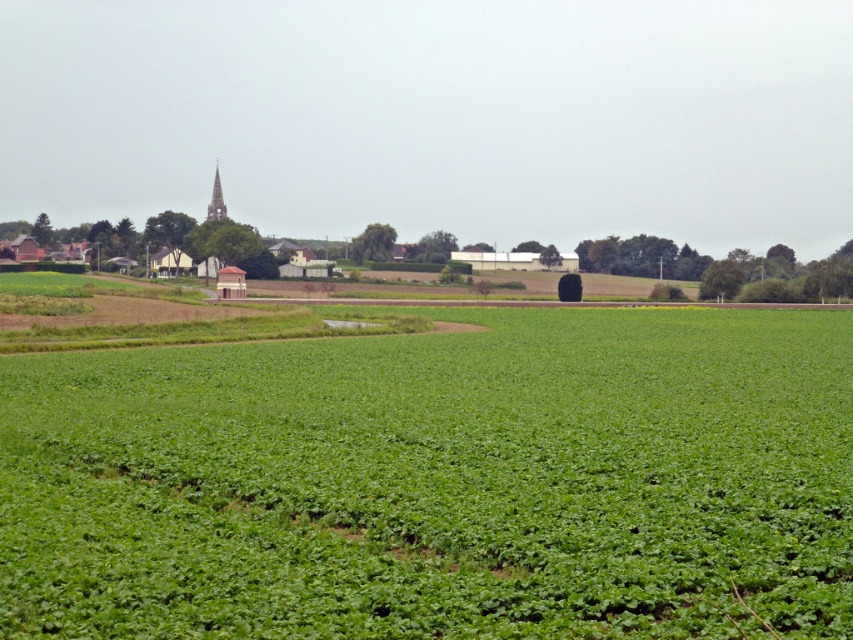
Does green leafy field at center have a lesser height compared to smooth gray spire at upper left?

Yes.

From the picture: Who is lower down, green leafy field at center or smooth gray spire at upper left?

Positioned lower is green leafy field at center.

I want to click on green leafy field at center, so click(x=438, y=481).

Where is `green leafy field at center`? Image resolution: width=853 pixels, height=640 pixels. green leafy field at center is located at coordinates (438, 481).